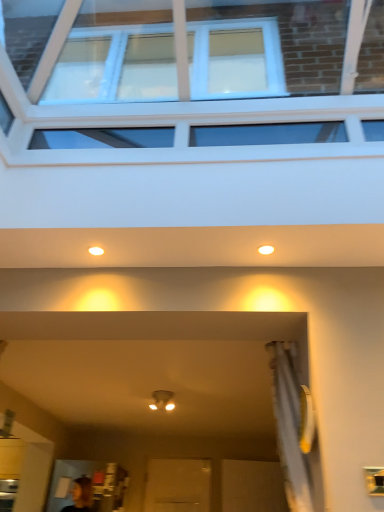
The image size is (384, 512). What do you see at coordinates (162, 400) in the screenshot?
I see `matte white light fixture at center` at bounding box center [162, 400].

Where is `matte white light fixture at center`? The width and height of the screenshot is (384, 512). matte white light fixture at center is located at coordinates (162, 400).

How much space does matte white light fixture at upper center, which is the second lighting from left to right, occupy vertically?

1.82 centimeters.

Identify the location of matte white light fixture at center. Image resolution: width=384 pixels, height=512 pixels. (162, 400).

Is matte white light fixture at center thinner than matte white light fixture at upper center, which is the second lighting from left to right?

Incorrect, the width of matte white light fixture at center is not less than that of matte white light fixture at upper center, which is the second lighting from left to right.

Considering the relative positions of matte white light fixture at center and matte white light fixture at upper center, the 1th lighting positioned from the right, in the image provided, is matte white light fixture at center behind matte white light fixture at upper center, the 1th lighting positioned from the right,?

Yes.

Which of these two, matte white light fixture at center or matte white light fixture at upper center, the 1th lighting positioned from the right, is bigger?

Bigger between the two is matte white light fixture at center.

From a real-world perspective, is matte white light fixture at center physically located above or below clear glass window at upper center?

matte white light fixture at center is below clear glass window at upper center.

Does matte white light fixture at center have a smaller size compared to clear glass window at upper center?

Indeed, matte white light fixture at center has a smaller size compared to clear glass window at upper center.

Considering the sizes of objects matte white light fixture at center and clear glass window at upper center in the image provided, who is shorter, matte white light fixture at center or clear glass window at upper center?

Standing shorter between the two is clear glass window at upper center.

Considering the sizes of matte white light fixture at center and clear glass window at upper center in the image, is matte white light fixture at center wider or thinner than clear glass window at upper center?

Clearly, matte white light fixture at center has less width compared to clear glass window at upper center.

Is matte white light fixture at upper center, the 1th lighting positioned from the right, completely or partially outside of clear glass window at upper center?

Actually, matte white light fixture at upper center, the 1th lighting positioned from the right, is at least partially inside clear glass window at upper center.

What's the angular difference between matte white light fixture at upper center, the 1th lighting positioned from the right, and clear glass window at upper center's facing directions?

The angular difference between matte white light fixture at upper center, the 1th lighting positioned from the right, and clear glass window at upper center is 180 degrees.

Considering the positions of objects matte white light fixture at upper center, which is the second lighting from left to right, and clear glass window at upper center in the image provided, who is in front, matte white light fixture at upper center, which is the second lighting from left to right, or clear glass window at upper center?

clear glass window at upper center is closer to the camera.

Which is behind, point (264, 249) or point (110, 58)?

Positioned behind is point (110, 58).

Does clear glass window at upper center have a lesser width compared to matte white light fixture at upper center, marked as the first lighting in a left-to-right arrangement?

No.

From a real-world perspective, is clear glass window at upper center located beneath matte white light fixture at upper center, which is the 2th lighting from right to left?

Incorrect, from a real-world perspective, clear glass window at upper center is higher than matte white light fixture at upper center, which is the 2th lighting from right to left.

Is point (339, 10) closer or farther from the camera than point (91, 248)?

Point (339, 10) is positioned farther from the camera compared to point (91, 248).

How distant is matte white light fixture at upper center, which is the 2th lighting from right to left, from matte white light fixture at center?

matte white light fixture at upper center, which is the 2th lighting from right to left, and matte white light fixture at center are 7.90 feet apart.

How many degrees apart are the facing directions of matte white light fixture at upper center, marked as the first lighting in a left-to-right arrangement, and matte white light fixture at center?

matte white light fixture at upper center, marked as the first lighting in a left-to-right arrangement, and matte white light fixture at center are facing 0.000393 degrees away from each other.

Considering the sizes of matte white light fixture at upper center, which is the 2th lighting from right to left, and matte white light fixture at center in the image, is matte white light fixture at upper center, which is the 2th lighting from right to left, wider or thinner than matte white light fixture at center?

Considering their sizes, matte white light fixture at upper center, which is the 2th lighting from right to left, looks slimmer than matte white light fixture at center.

Does matte white light fixture at upper center, marked as the first lighting in a left-to-right arrangement, touch matte white light fixture at center?

No.

Is matte white light fixture at upper center, which is the second lighting from left to right, turned away from matte white light fixture at center?

That's right, matte white light fixture at upper center, which is the second lighting from left to right, is facing away from matte white light fixture at center.

Which object is closer to the camera, matte white light fixture at upper center, the 1th lighting positioned from the right, or matte white light fixture at center?

Positioned in front is matte white light fixture at upper center, the 1th lighting positioned from the right.

From the image's perspective, is matte white light fixture at upper center, which is the second lighting from left to right, located above matte white light fixture at center?

Yes, from the image's perspective, matte white light fixture at upper center, which is the second lighting from left to right, is over matte white light fixture at center.

This screenshot has height=512, width=384. I want to click on light fixture on the left side of matte white light fixture at upper center, the 1th lighting positioned from the right, so click(162, 400).

Is matte white light fixture at upper center, marked as the first lighting in a left-to-right arrangement, at the right side of matte white light fixture at upper center, the 1th lighting positioned from the right?

Incorrect, matte white light fixture at upper center, marked as the first lighting in a left-to-right arrangement, is not on the right side of matte white light fixture at upper center, the 1th lighting positioned from the right.

Considering the relative sizes of matte white light fixture at upper center, which is the 2th lighting from right to left, and matte white light fixture at upper center, which is the second lighting from left to right, in the image provided, is matte white light fixture at upper center, which is the 2th lighting from right to left, shorter than matte white light fixture at upper center, which is the second lighting from left to right,?

No.

At what (x,y) coordinates should I click in order to perform the action: click on the 2nd lighting above the matte white light fixture at center (from the image's perspective). Please return your answer as a coordinate pair (x, y). Looking at the image, I should click on (266, 250).

Locate an element on the screen. This screenshot has width=384, height=512. window located on the right of matte white light fixture at center is located at coordinates (190, 79).

Considering their positions, is matte white light fixture at upper center, which is the second lighting from left to right, positioned closer to clear glass window at upper center than matte white light fixture at upper center, marked as the first lighting in a left-to-right arrangement?

matte white light fixture at upper center, marked as the first lighting in a left-to-right arrangement.

From the picture: Based on their spatial positions, is matte white light fixture at upper center, which is the 2th lighting from right to left, or matte white light fixture at upper center, the 1th lighting positioned from the right, closer to matte white light fixture at center?

The object closer to matte white light fixture at center is matte white light fixture at upper center, which is the 2th lighting from right to left.

Looking at the image, which one is located further to matte white light fixture at upper center, the 1th lighting positioned from the right, matte white light fixture at upper center, marked as the first lighting in a left-to-right arrangement, or clear glass window at upper center?

Among the two, clear glass window at upper center is located further to matte white light fixture at upper center, the 1th lighting positioned from the right.

Based on their spatial positions, is clear glass window at upper center or matte white light fixture at upper center, marked as the first lighting in a left-to-right arrangement, closer to matte white light fixture at center?

Among the two, matte white light fixture at upper center, marked as the first lighting in a left-to-right arrangement, is located nearer to matte white light fixture at center.

Based on their spatial positions, is matte white light fixture at upper center, which is the 2th lighting from right to left, or matte white light fixture at center closer to clear glass window at upper center?

Among the two, matte white light fixture at upper center, which is the 2th lighting from right to left, is located nearer to clear glass window at upper center.

In the scene shown: When comparing their distances from matte white light fixture at upper center, which is the 2th lighting from right to left, does clear glass window at upper center or matte white light fixture at upper center, the 1th lighting positioned from the right, seem further?

Based on the image, clear glass window at upper center appears to be further to matte white light fixture at upper center, which is the 2th lighting from right to left.

Looking at the image, which one is located closer to matte white light fixture at upper center, the 1th lighting positioned from the right, matte white light fixture at center or matte white light fixture at upper center, marked as the first lighting in a left-to-right arrangement?

Among the two, matte white light fixture at upper center, marked as the first lighting in a left-to-right arrangement, is located nearer to matte white light fixture at upper center, the 1th lighting positioned from the right.

Looking at the image, which one is located further to matte white light fixture at upper center, the 1th lighting positioned from the right, matte white light fixture at upper center, which is the 2th lighting from right to left, or matte white light fixture at center?

Among the two, matte white light fixture at center is located further to matte white light fixture at upper center, the 1th lighting positioned from the right.

Locate an element on the screen. lighting between clear glass window at upper center and matte white light fixture at upper center, which is the 2th lighting from right to left, in the front-back direction is located at coordinates (266, 250).

Image resolution: width=384 pixels, height=512 pixels. Identify the location of lighting between matte white light fixture at upper center, which is the second lighting from left to right, and matte white light fixture at center in the front-back direction. (96, 251).